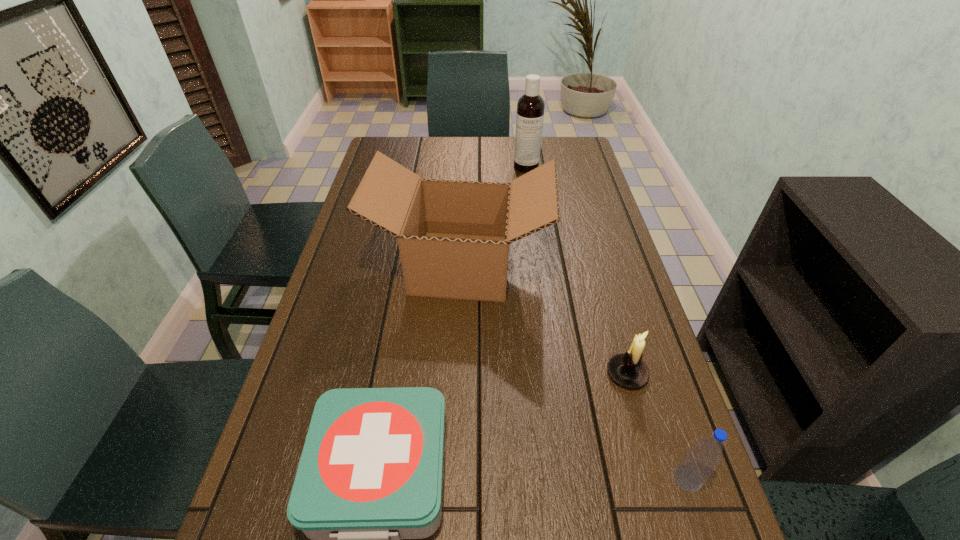
The image size is (960, 540). I want to click on free space located 0.240m on the left of the second shortest object, so click(x=504, y=374).

At what (x,y) coordinates should I click in order to perform the action: click on object positioned at the far edge. Please return your answer as a coordinate pair (x, y). This screenshot has width=960, height=540. Looking at the image, I should click on (530, 108).

Find the location of `object that is at the left edge`. object that is at the left edge is located at coordinates (453, 236).

This screenshot has height=540, width=960. I want to click on water bottle situated at the right edge, so click(698, 464).

Where is `candle holder that is at the right edge`? Image resolution: width=960 pixels, height=540 pixels. candle holder that is at the right edge is located at coordinates (627, 369).

Identify the location of free space at the far edge. Image resolution: width=960 pixels, height=540 pixels. (509, 143).

In the image, there is a desktop. At what (x,y) coordinates should I click in order to perform the action: click on vacant space at the left edge. Please return your answer as a coordinate pair (x, y). Looking at the image, I should click on (353, 232).

Locate an element on the screen. This screenshot has height=540, width=960. vacant region at the right edge of the desktop is located at coordinates (589, 183).

Find the location of a particular element. The height and width of the screenshot is (540, 960). vacant space at the far left corner of the desktop is located at coordinates (387, 145).

The image size is (960, 540). In the image, there is a desktop. What are the coordinates of `vacant space at the far right corner` in the screenshot? It's located at (553, 140).